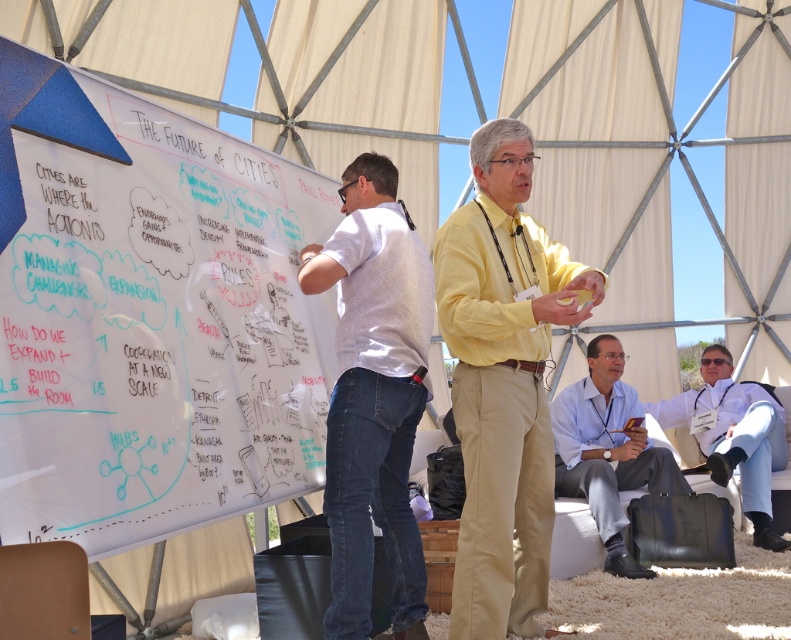
Question: Which object is the farthest from the khaki pants at center?

Choices:
 (A) whiteboard at left
 (B) white cotton shirt at left
 (C) white fabric shirt at right

Answer: (C)

Question: Is khaki pants at center above white cotton shirt at left?

Choices:
 (A) no
 (B) yes

Answer: (A)

Question: Can you confirm if white cotton shirt at left is positioned to the right of white fabric shirt at right?

Choices:
 (A) yes
 (B) no

Answer: (B)

Question: Does khaki pants at center have a larger size compared to white shirt at right?

Choices:
 (A) yes
 (B) no

Answer: (B)

Question: Which point appears closest to the camera in this image?

Choices:
 (A) (360, 170)
 (B) (735, 394)

Answer: (A)

Question: Which point is closer to the camera taking this photo?

Choices:
 (A) (498, 474)
 (B) (327, 614)

Answer: (B)